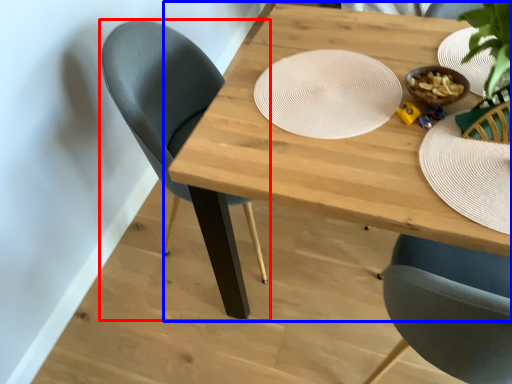
Question: Which object appears farthest to the camera in this image, chair (highlighted by a red box) or table (highlighted by a blue box)?

Choices:
 (A) chair
 (B) table

Answer: (A)